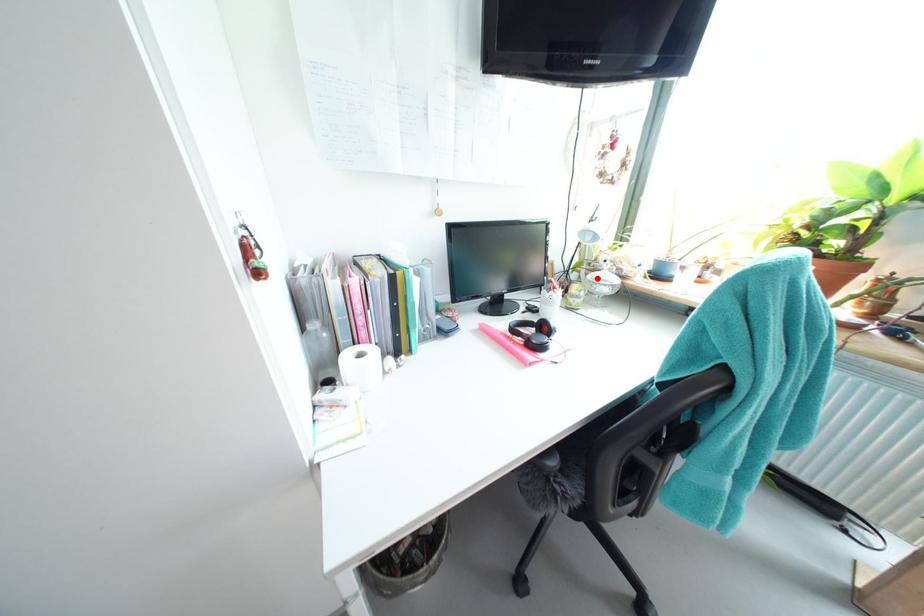
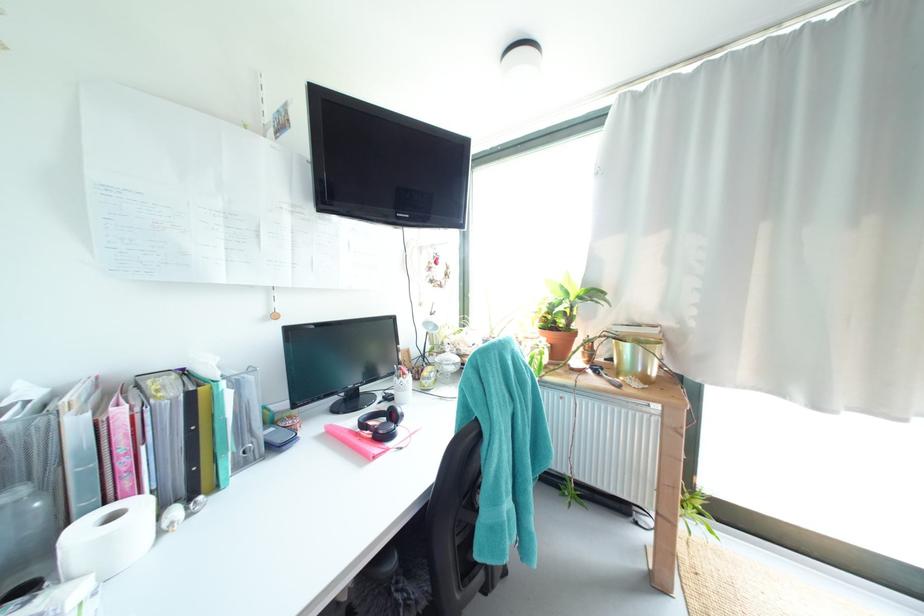
Question: A red point is marked in image1. In image2, is the corresponding 3D point closer to the camera or farther? Reply with the corresponding letter.

Choices:
 (A) The corresponding 3D point is closer.
 (B) The corresponding 3D point is farther.

Answer: (B)